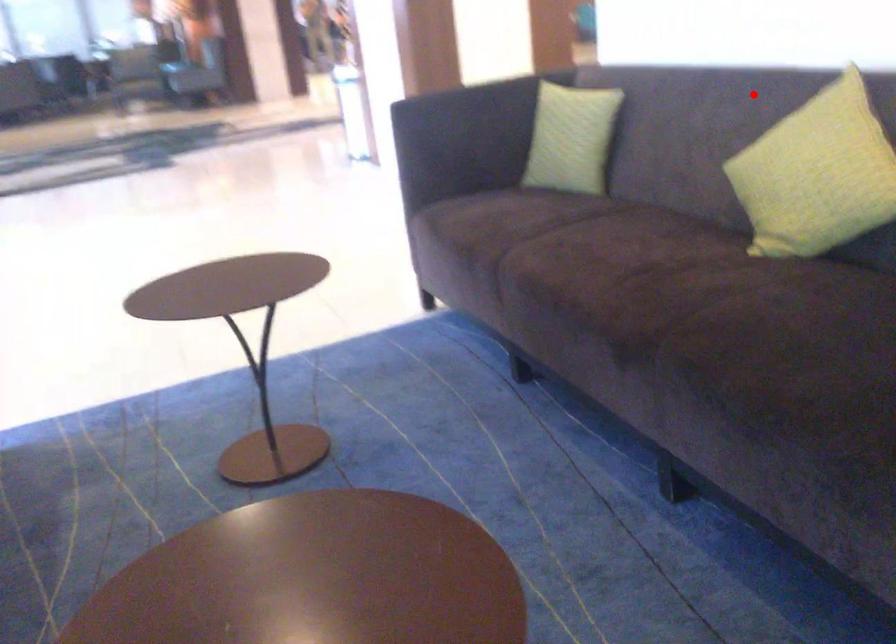
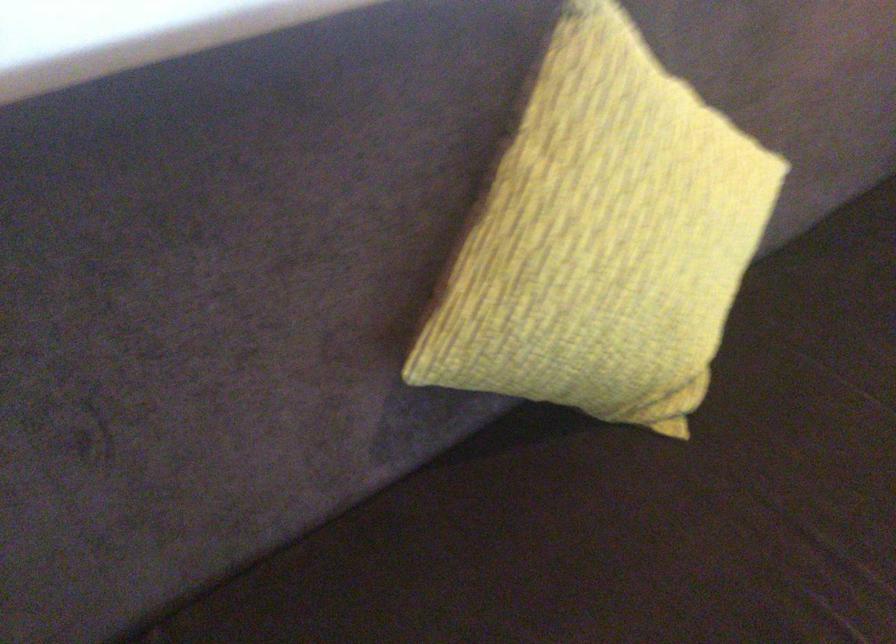
Question: I am providing you with two images of the same scene from different viewpoints. Given a red point in image1, look at the same physical point in image2. Is it:

Choices:
 (A) Closer to the viewpoint
 (B) Farther from the viewpoint

Answer: (A)